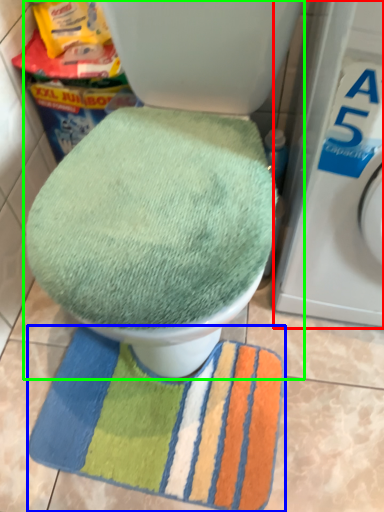
Question: Estimate the real-world distances between objects in this image. Which object is farther from washing machine (highlighted by a red box), beach towel (highlighted by a blue box) or toilet (highlighted by a green box)?

Choices:
 (A) beach towel
 (B) toilet

Answer: (A)